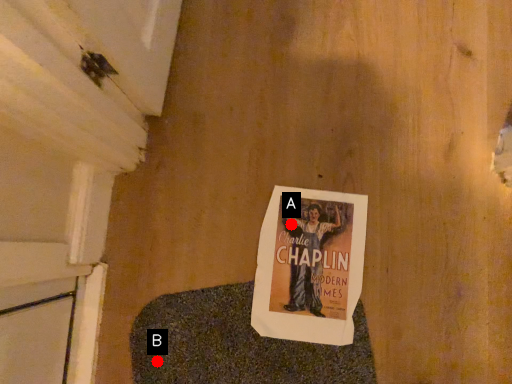
Question: Two points are circled on the image, labeled by A and B beside each circle. Among these points, which one is farthest from the camera?

Choices:
 (A) A is further
 (B) B is further

Answer: (A)